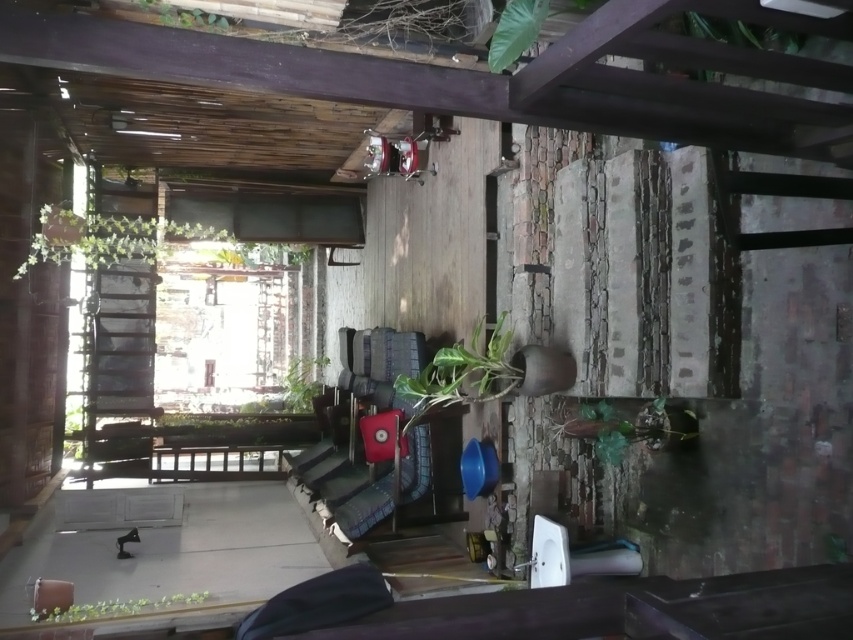
Question: Observing the image, what is the correct spatial positioning of green matte plant at center in reference to green leafy plant at upper center?

Choices:
 (A) below
 (B) above

Answer: (A)

Question: Among these points, which one is farthest from the camera?

Choices:
 (A) (131, 600)
 (B) (498, 348)
 (C) (254, 260)
 (D) (590, 422)

Answer: (C)

Question: Does green glossy plant at lower center lie in front of green matte plant at center?

Choices:
 (A) yes
 (B) no

Answer: (A)

Question: Is green glossy plant at center smaller than green leafy plant at upper center?

Choices:
 (A) yes
 (B) no

Answer: (B)

Question: Which point appears closest to the camera in this image?

Choices:
 (A) (241, 243)
 (B) (167, 17)
 (C) (318, 371)

Answer: (B)

Question: Considering the real-world distances, which object is farthest from the green matte plant at center?

Choices:
 (A) green leafy plant at upper center
 (B) green matte plant at lower left
 (C) green glossy plant at center
 (D) green glossy plant at lower center

Answer: (A)